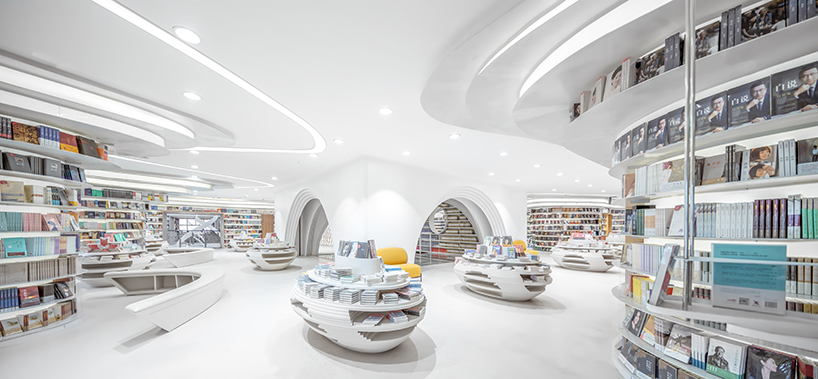
Where is `windows`? This screenshot has width=818, height=379. windows is located at coordinates (191, 223), (326, 238).